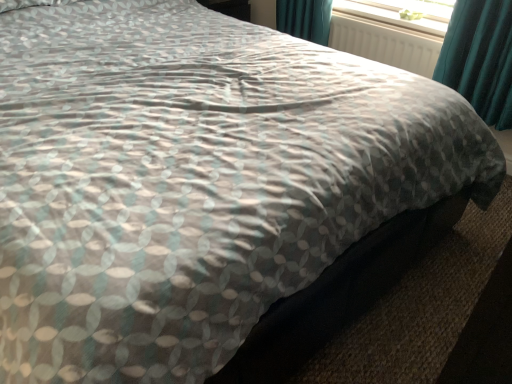
Question: Considering the positions of white textured radiator at upper center and transparent plastic window screen at upper right in the image, is white textured radiator at upper center bigger or smaller than transparent plastic window screen at upper right?

Choices:
 (A) small
 (B) big

Answer: (B)

Question: Does point (428, 36) appear closer or farther from the camera than point (440, 16)?

Choices:
 (A) closer
 (B) farther

Answer: (A)

Question: In the image, is white textured radiator at upper center on the left side or the right side of transparent plastic window screen at upper right?

Choices:
 (A) right
 (B) left

Answer: (B)

Question: From a real-world perspective, is transparent plastic window screen at upper right physically located above or below white textured radiator at upper center?

Choices:
 (A) above
 (B) below

Answer: (A)

Question: In the image, is transparent plastic window screen at upper right on the left side or the right side of white textured radiator at upper center?

Choices:
 (A) left
 (B) right

Answer: (B)

Question: From the image's perspective, is transparent plastic window screen at upper right above or below white textured radiator at upper center?

Choices:
 (A) below
 (B) above

Answer: (B)

Question: In terms of height, does transparent plastic window screen at upper right look taller or shorter compared to white textured radiator at upper center?

Choices:
 (A) tall
 (B) short

Answer: (B)